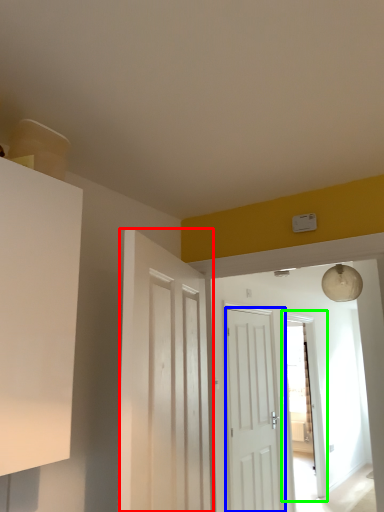
Question: Which is nearer to the door (highlighted by a red box)? door (highlighted by a blue box) or glass door (highlighted by a green box).

Choices:
 (A) door
 (B) glass door

Answer: (A)